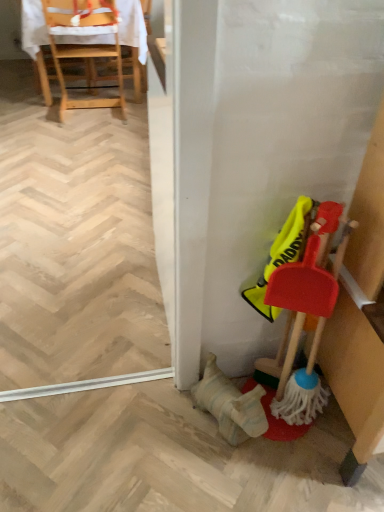
The height and width of the screenshot is (512, 384). I want to click on free location in front of wooden chair at upper left, so (x=76, y=132).